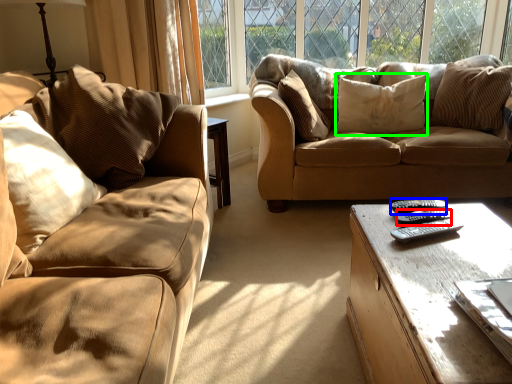
Question: Which is farther away from remote (highlighted by a red box)? remote (highlighted by a blue box) or pillow (highlighted by a green box)?

Choices:
 (A) remote
 (B) pillow

Answer: (B)